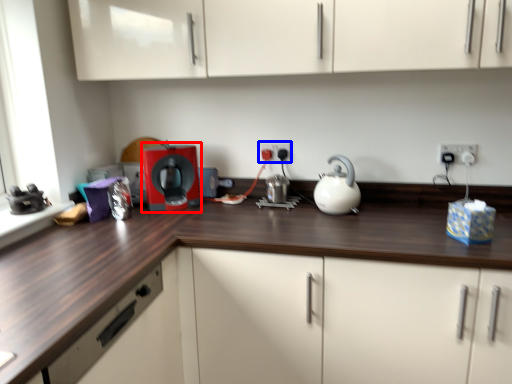
Question: Among these objects, which one is farthest to the camera, home appliance (highlighted by a red box) or electric outlet (highlighted by a blue box)?

Choices:
 (A) home appliance
 (B) electric outlet

Answer: (B)